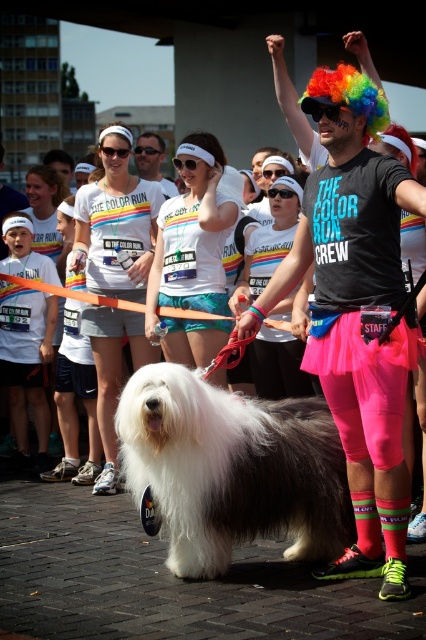
You are a participant in the Color Run event and notice two items at the center of the image. Which item is closer to the ground between the neon pink spandex at center and the matte white shirt at center?

The neon pink spandex at center is positioned under the matte white shirt at center, so the neon pink spandex at center is closer to the ground.

You are a participant in the Color Run and you see the white fluffy dog at center and the matte white shirt at center. Which object is closer to you?

The white fluffy dog at center is closer to you because it is in front of the matte white shirt at center.